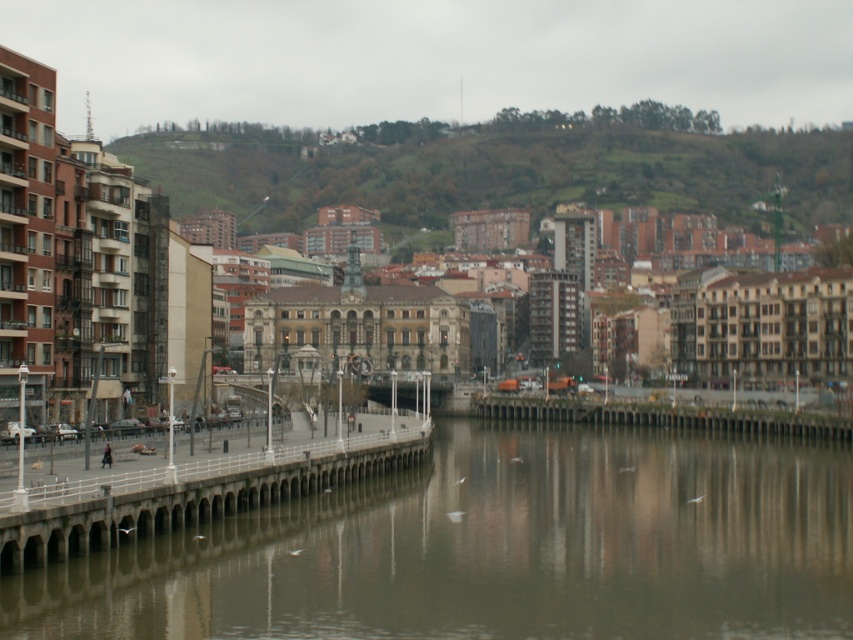
Question: Is green grassy hillside at upper center further to camera compared to concrete dock at lower left?

Choices:
 (A) no
 (B) yes

Answer: (B)

Question: Which object is the closest to the smooth concrete river at center?

Choices:
 (A) concrete dock at lower left
 (B) concrete bridge at center
 (C) green grassy hillside at upper center

Answer: (A)

Question: Observing the image, what is the correct spatial positioning of smooth concrete river at center in reference to concrete bridge at center?

Choices:
 (A) below
 (B) above

Answer: (A)

Question: Which point is closer to the camera?

Choices:
 (A) concrete dock at lower left
 (B) green grassy hillside at upper center
 (C) smooth concrete river at center
 (D) concrete bridge at center

Answer: (C)

Question: Is smooth concrete river at center further to the viewer compared to concrete bridge at center?

Choices:
 (A) no
 (B) yes

Answer: (A)

Question: Which of the following is the closest to the observer?

Choices:
 (A) (798, 419)
 (B) (431, 554)
 (C) (90, 528)
 (D) (747, 220)

Answer: (C)